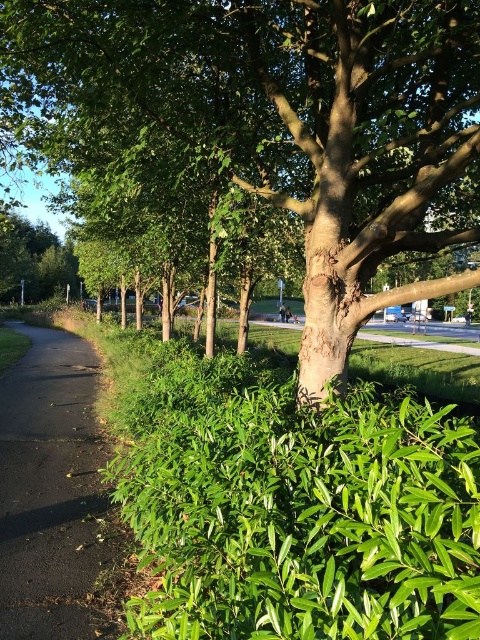
Consider the image. You are a landscape architect designing a new garden. You need to place a 2.5 meter tall statue between the green bark tree at center and the black asphalt path at left. Which object should the statue be placed closer to so it doesn

The statue should be placed closer to the black asphalt path at left because the green bark tree at center is taller than the black asphalt path at left, so positioning the statue near the shorter object would maintain visual balance.

You are a gardener planning to install a 6 meter long fence between the green bark tree at center and the black asphalt path at left. Based on the scene, will the fence fit without overlapping either the tree or the path?

The distance between the green bark tree at center and the black asphalt path at left is 5.63 meters. Since the fence is 6 meters long, it will be 0.37 meters longer than the available space, so it will overlap both the tree and the path.

You are a gardener planning to plant a new flower bed between the green bark tree at center and the black asphalt path at left. Based on their positions, which side of the tree should you place the flower bed to ensure it is closest to the path?

The green bark tree at center is to the right of the black asphalt path at left, so placing the flower bed to the left side of the tree would position it closest to the path.